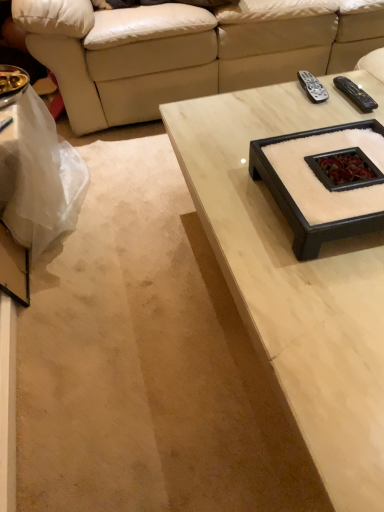
Where is `white plastic bag at lower left`? white plastic bag at lower left is located at coordinates (35, 192).

What do you see at coordinates (312, 87) in the screenshot? Image resolution: width=384 pixels, height=512 pixels. I see `black plastic remote at upper right, placed as the 1th remote when sorted from left to right` at bounding box center [312, 87].

In order to face black plastic remote at upper right, arranged as the 1th remote when viewed from the right, should I rotate leftwards or rightwards?

To face it directly, rotate right by 20.629 degrees.

This screenshot has width=384, height=512. Describe the element at coordinates (355, 94) in the screenshot. I see `black plastic remote at upper right, arranged as the 1th remote when viewed from the right` at that location.

The width and height of the screenshot is (384, 512). Describe the element at coordinates (295, 279) in the screenshot. I see `white marble coffee table at upper center` at that location.

What is the approximate width of white marble coffee table at upper center?

The width of white marble coffee table at upper center is 83.13 centimeters.

The height and width of the screenshot is (512, 384). What are the coordinates of `beige leather couch at upper center` in the screenshot? It's located at (x=188, y=50).

Identify the location of white plastic bag at lower left. (35, 192).

From a real-world perspective, is white plastic bag at lower left on black plastic remote at upper right, acting as the 2th remote starting from the left?

Actually, white plastic bag at lower left is physically below black plastic remote at upper right, acting as the 2th remote starting from the left, in the real world.

Can you see white plastic bag at lower left touching black plastic remote at upper right, arranged as the 1th remote when viewed from the right?

No, white plastic bag at lower left is not in contact with black plastic remote at upper right, arranged as the 1th remote when viewed from the right.

The height and width of the screenshot is (512, 384). I want to click on table to the left of black plastic remote at upper right, acting as the 2th remote starting from the left, so click(x=35, y=192).

Relative to black plastic remote at upper right, acting as the 2th remote starting from the left, is white plastic bag at lower left in front or behind?

Visually, white plastic bag at lower left is located in front of black plastic remote at upper right, acting as the 2th remote starting from the left.

From the image's perspective, is black plastic remote at upper right, acting as the 2th remote starting from the left, located above or below black plastic remote at upper right, arranged as the second remote when viewed from the right?

From the image's perspective, black plastic remote at upper right, acting as the 2th remote starting from the left, appears below black plastic remote at upper right, arranged as the second remote when viewed from the right.

Would you say black plastic remote at upper right, acting as the 2th remote starting from the left, is outside black plastic remote at upper right, arranged as the second remote when viewed from the right?

black plastic remote at upper right, acting as the 2th remote starting from the left, lies outside black plastic remote at upper right, arranged as the second remote when viewed from the right,'s area.

Considering the relative positions of black plastic remote at upper right, acting as the 2th remote starting from the left, and black plastic remote at upper right, arranged as the second remote when viewed from the right, in the image provided, is black plastic remote at upper right, acting as the 2th remote starting from the left, to the right of black plastic remote at upper right, arranged as the second remote when viewed from the right, from the viewer's perspective?

Correct, you'll find black plastic remote at upper right, acting as the 2th remote starting from the left, to the right of black plastic remote at upper right, arranged as the second remote when viewed from the right.

Considering the sizes of objects black plastic remote at upper right, placed as the 1th remote when sorted from left to right, and beige leather couch at upper center in the image provided, who is bigger, black plastic remote at upper right, placed as the 1th remote when sorted from left to right, or beige leather couch at upper center?

Bigger between the two is beige leather couch at upper center.

Looking at this image, is black plastic remote at upper right, placed as the 1th remote when sorted from left to right, behind beige leather couch at upper center?

No, black plastic remote at upper right, placed as the 1th remote when sorted from left to right, is in front of beige leather couch at upper center.

How many degrees apart are the facing directions of beige leather couch at upper center and white marble coffee table at upper center?

90.5 degrees.

Between beige leather couch at upper center and white marble coffee table at upper center, which one has larger size?

Bigger between the two is beige leather couch at upper center.

From the image's perspective, which is above, beige leather couch at upper center or white marble coffee table at upper center?

beige leather couch at upper center appears higher in the image.

Considering the sizes of objects beige leather couch at upper center and white marble coffee table at upper center in the image provided, who is thinner, beige leather couch at upper center or white marble coffee table at upper center?

Thinner between the two is white marble coffee table at upper center.

Looking at the image, does white marble coffee table at upper center seem bigger or smaller compared to white plastic bag at lower left?

Considering their sizes, white marble coffee table at upper center takes up more space than white plastic bag at lower left.

From the image's perspective, relative to white plastic bag at lower left, is white marble coffee table at upper center above or below?

Clearly, from the image's perspective, white marble coffee table at upper center is below white plastic bag at lower left.

Does point (230, 223) appear closer or farther from the camera than point (64, 147)?

Point (230, 223) is positioned closer to the camera compared to point (64, 147).

Is white marble coffee table at upper center oriented towards white plastic bag at lower left?

No, white marble coffee table at upper center does not turn towards white plastic bag at lower left.

Looking at this image, between beige leather couch at upper center and black plastic remote at upper right, arranged as the 1th remote when viewed from the right, which one is positioned in front?

black plastic remote at upper right, arranged as the 1th remote when viewed from the right, is in front.

Where is `studio couch on the left of black plastic remote at upper right, arranged as the 1th remote when viewed from the right`? studio couch on the left of black plastic remote at upper right, arranged as the 1th remote when viewed from the right is located at coordinates (188, 50).

How many degrees apart are the facing directions of beige leather couch at upper center and black plastic remote at upper right, arranged as the 1th remote when viewed from the right?

beige leather couch at upper center and black plastic remote at upper right, arranged as the 1th remote when viewed from the right, are facing 90.5 degrees away from each other.

Is white plastic bag at lower left facing away from white marble coffee table at upper center?

No, white plastic bag at lower left's orientation is not away from white marble coffee table at upper center.

Between white plastic bag at lower left and white marble coffee table at upper center, which one has larger width?

Wider between the two is white marble coffee table at upper center.

Identify the location of table located above the white marble coffee table at upper center (from a real-world perspective). The image size is (384, 512). (35, 192).

Considering the points (53, 228) and (353, 428), which point is behind, point (53, 228) or point (353, 428)?

The point (53, 228) is farther from the camera.

The image size is (384, 512). Identify the location of table below the black plastic remote at upper right, acting as the 2th remote starting from the left (from a real-world perspective). (35, 192).

Locate an element on the screen. The width and height of the screenshot is (384, 512). remote lying on the left of black plastic remote at upper right, arranged as the 1th remote when viewed from the right is located at coordinates (312, 87).

Looking at the image, which one is located further to black plastic remote at upper right, arranged as the second remote when viewed from the right, beige leather couch at upper center or white marble coffee table at upper center?

The object further to black plastic remote at upper right, arranged as the second remote when viewed from the right, is beige leather couch at upper center.

Estimate the real-world distances between objects in this image. Which object is further from black plastic remote at upper right, arranged as the 1th remote when viewed from the right, white plastic bag at lower left or beige leather couch at upper center?

white plastic bag at lower left is further to black plastic remote at upper right, arranged as the 1th remote when viewed from the right.

Looking at this image, when comparing their distances from beige leather couch at upper center, does white marble coffee table at upper center or black plastic remote at upper right, placed as the 1th remote when sorted from left to right, seem closer?

black plastic remote at upper right, placed as the 1th remote when sorted from left to right.

Which object lies further to the anchor point black plastic remote at upper right, placed as the 1th remote when sorted from left to right, white plastic bag at lower left or white marble coffee table at upper center?

white plastic bag at lower left is further to black plastic remote at upper right, placed as the 1th remote when sorted from left to right.

Estimate the real-world distances between objects in this image. Which object is closer to black plastic remote at upper right, acting as the 2th remote starting from the left, black plastic remote at upper right, arranged as the second remote when viewed from the right, or beige leather couch at upper center?

The object closer to black plastic remote at upper right, acting as the 2th remote starting from the left, is black plastic remote at upper right, arranged as the second remote when viewed from the right.

From the image, which object appears to be nearer to black plastic remote at upper right, placed as the 1th remote when sorted from left to right, black plastic remote at upper right, acting as the 2th remote starting from the left, or beige leather couch at upper center?

black plastic remote at upper right, acting as the 2th remote starting from the left, is positioned closer to the anchor black plastic remote at upper right, placed as the 1th remote when sorted from left to right.

Considering their positions, is white plastic bag at lower left positioned further to beige leather couch at upper center than white marble coffee table at upper center?

Based on the image, white marble coffee table at upper center appears to be further to beige leather couch at upper center.

Looking at the image, which one is located further to black plastic remote at upper right, arranged as the 1th remote when viewed from the right, beige leather couch at upper center or white plastic bag at lower left?

The object further to black plastic remote at upper right, arranged as the 1th remote when viewed from the right, is white plastic bag at lower left.

The height and width of the screenshot is (512, 384). In order to click on remote between beige leather couch at upper center and black plastic remote at upper right, arranged as the 1th remote when viewed from the right, from top to bottom in this screenshot , I will do `click(312, 87)`.

Where is `studio couch located between white plastic bag at lower left and black plastic remote at upper right, arranged as the second remote when viewed from the right, in the left-right direction`? This screenshot has width=384, height=512. studio couch located between white plastic bag at lower left and black plastic remote at upper right, arranged as the second remote when viewed from the right, in the left-right direction is located at coordinates (188, 50).

Where is `table between beige leather couch at upper center and white marble coffee table at upper center in the up-down direction`? table between beige leather couch at upper center and white marble coffee table at upper center in the up-down direction is located at coordinates (x=35, y=192).

At what (x,y) coordinates should I click in order to perform the action: click on remote between white plastic bag at lower left and black plastic remote at upper right, arranged as the 1th remote when viewed from the right, from left to right. Please return your answer as a coordinate pair (x, y). Looking at the image, I should click on (312, 87).